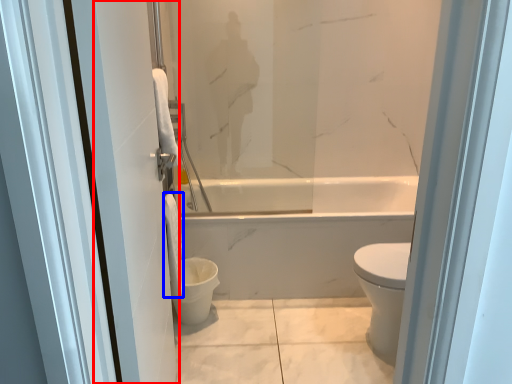
Question: Among these objects, which one is nearest to the camera, screen door (highlighted by a red box) or toilet paper (highlighted by a blue box)?

Choices:
 (A) screen door
 (B) toilet paper

Answer: (A)